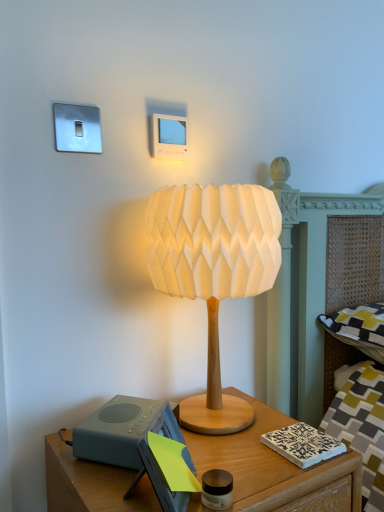
Question: Is gray matte speaker at lower left in front of or behind wooden nightstand at lower center in the image?

Choices:
 (A) behind
 (B) front

Answer: (A)

Question: From the image's perspective, relative to wooden nightstand at lower center, is gray matte speaker at lower left above or below?

Choices:
 (A) above
 (B) below

Answer: (A)

Question: Considering the real-world distances, which object is farthest from the white paper lampshade at center?

Choices:
 (A) gray matte speaker at lower left
 (B) wooden nightstand at lower center

Answer: (B)

Question: Which object is the farthest from the gray matte speaker at lower left?

Choices:
 (A) white paper lampshade at center
 (B) wooden nightstand at lower center

Answer: (A)